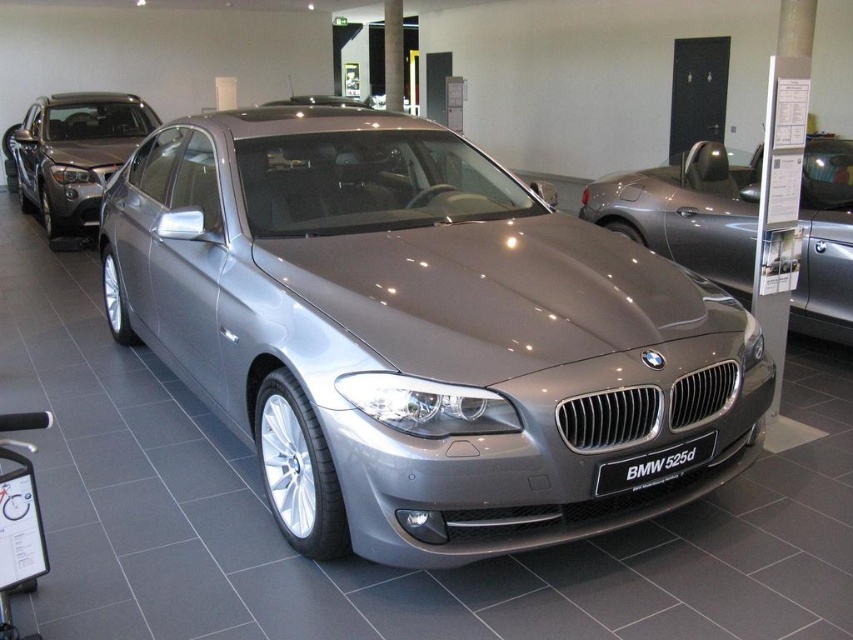
You are a photographer setting up a shoot in the car showroom. You need to position a light source above the satin metallic car at center and the satin silver metallic car at center. Based on their positions, which car should you place the light source above first?

The satin metallic car at center should be lit first because it is positioned below the satin silver metallic car at center, meaning the light source needs to be placed above the lower car first to avoid shadows from the upper car blocking the light.

You are a car salesman who needs to guide a customer to the satin metallic car at center and the satin silver metallic car at center. Since both cars are in the showroom, can you tell the customer which one is on the left side?

The satin metallic car at center is positioned on the left side of the satin silver metallic car at center, so the satin metallic car at center is the one on the left.

You are a customer in the car showroom and want to take a photo of the satin silver metallic car at center and the satin silver metallic sedan at center. Which one should you focus on first if you want to capture both in a single frame without moving your camera?

The satin silver metallic car at center is below the satin silver metallic sedan at center, so you should focus on the satin silver metallic sedan at center first to ensure both are in the frame.